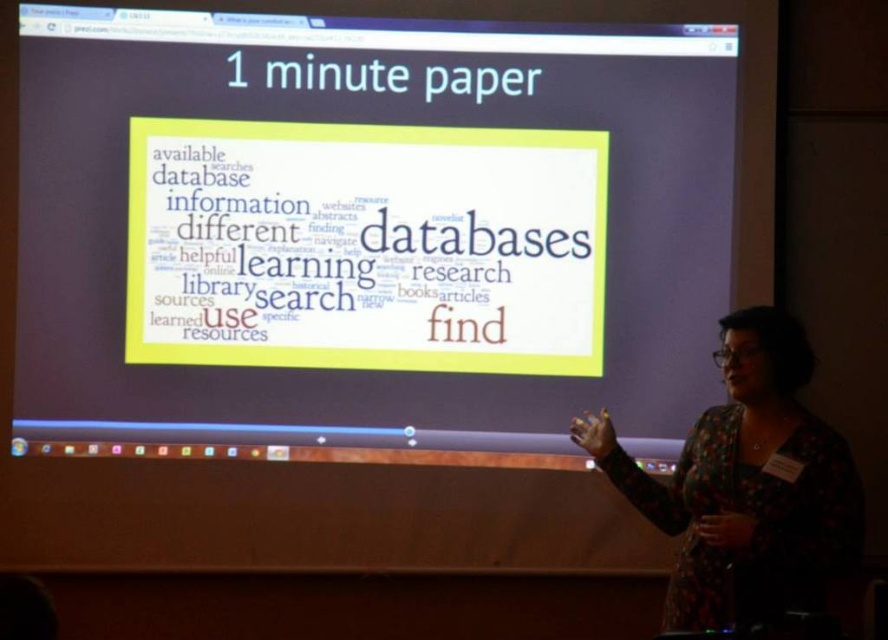
Question: Among these objects, which one is farthest from the camera?

Choices:
 (A) white paper at center
 (B) floral-patterned blouse at right

Answer: (A)

Question: Is white paper at center positioned behind floral-patterned blouse at right?

Choices:
 (A) yes
 (B) no

Answer: (A)

Question: Is white paper at center below floral-patterned blouse at right?

Choices:
 (A) no
 (B) yes

Answer: (A)

Question: Is white paper at center bigger than floral-patterned blouse at right?

Choices:
 (A) no
 (B) yes

Answer: (A)

Question: Which object appears farthest from the camera in this image?

Choices:
 (A) floral-patterned blouse at right
 (B) white paper at center

Answer: (B)